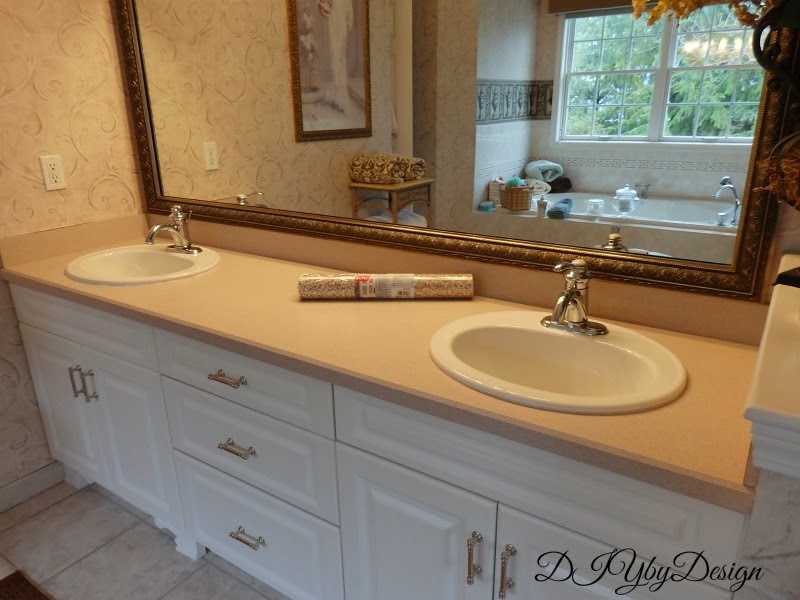
Image resolution: width=800 pixels, height=600 pixels. In order to click on contact paper in this screenshot , I will do `click(446, 283)`.